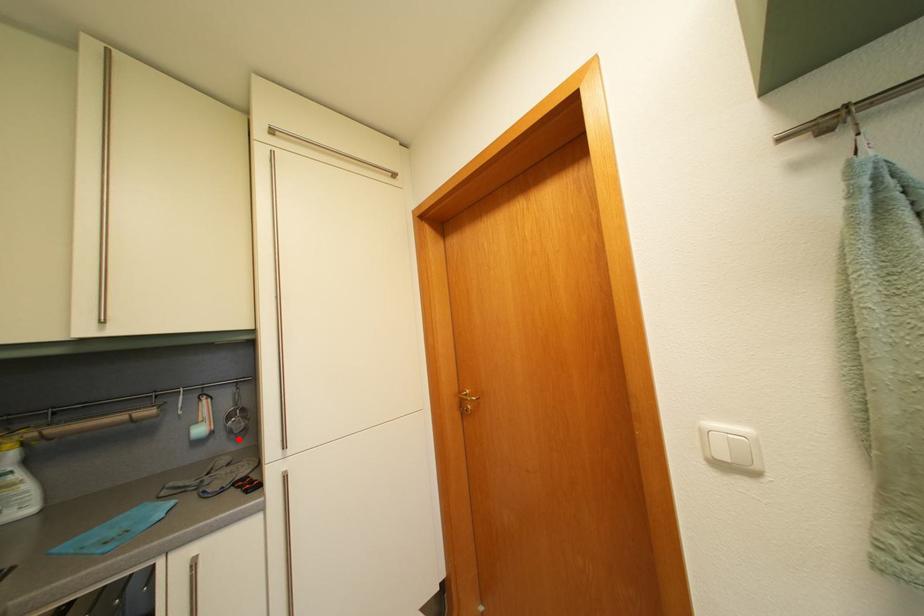
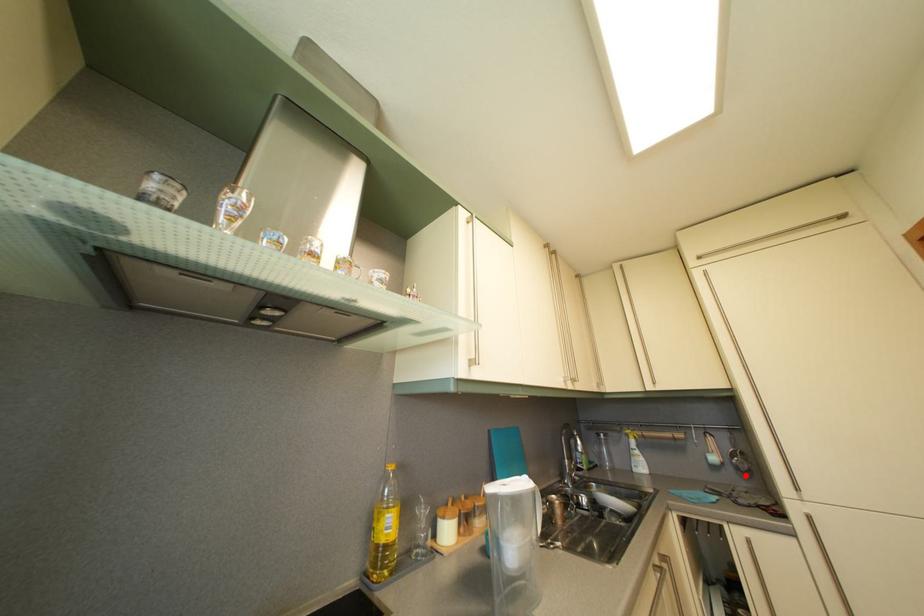
I am providing you with two images of the same scene from different viewpoints. A red point is marked on the first image and another point is marked on the second image. Do the highlighted points in image1 and image2 indicate the same real-world spot?

Yes